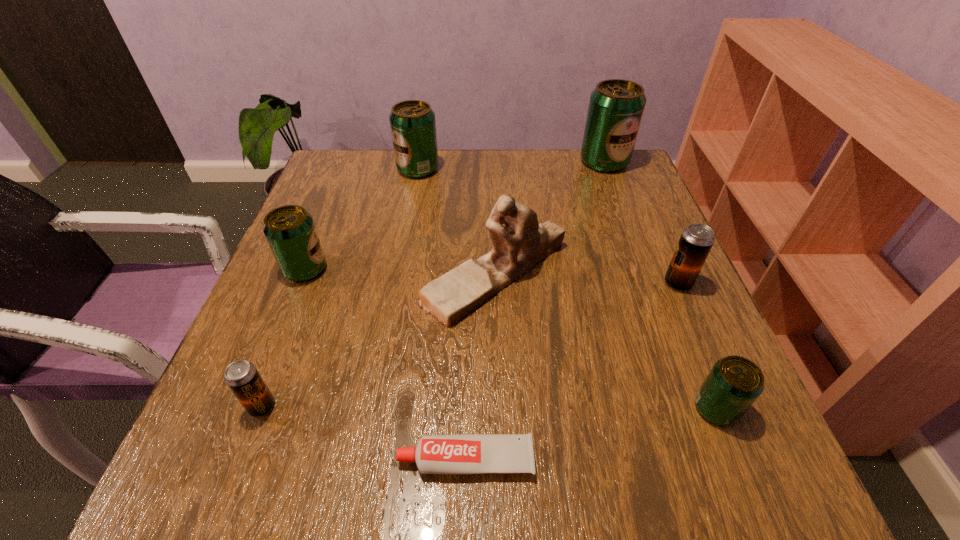
You are a GUI agent. You are given a task and a screenshot of the screen. Output one action in this format:
    pyautogui.click(x=<x>, y=<y>)
    Task: Click on the vacant space at the far right corner of the desktop
    This screenshot has height=540, width=960.
    Given the screenshot: What is the action you would take?
    pyautogui.click(x=595, y=173)

Locate an element on the screen. This screenshot has height=540, width=960. empty space that is in between the leftmost green beer can and the biggest green beer can is located at coordinates (455, 215).

At what (x,y) coordinates should I click in order to perform the action: click on vacant space that is in between the smallest green beer can and the figurine. Please return your answer as a coordinate pair (x, y). Looking at the image, I should click on (606, 341).

You are a GUI agent. You are given a task and a screenshot of the screen. Output one action in this format:
    pyautogui.click(x=<x>, y=<y>)
    Task: Click on the vacant point located between the second biggest green beer can and the biggest green beer can
    The height and width of the screenshot is (540, 960).
    Given the screenshot: What is the action you would take?
    pyautogui.click(x=511, y=165)

Locate an element on the screen. The height and width of the screenshot is (540, 960). empty space that is in between the nearest object and the leftmost green beer can is located at coordinates 385,364.

In order to click on vacant area between the third beer can from left to right and the smaller black beer can in this screenshot , I will do `click(340, 288)`.

This screenshot has height=540, width=960. Identify the location of unoccupied area between the fourth beer can from right to left and the figurine. (457, 221).

This screenshot has width=960, height=540. What are the coordinates of `free space between the farther black beer can and the smallest green beer can` in the screenshot? It's located at (697, 346).

In order to click on vacant space in between the second smallest green beer can and the smallest green beer can in this screenshot , I will do `click(511, 339)`.

Identify the location of vacant space that is in between the bigger black beer can and the shortest object. The width and height of the screenshot is (960, 540). (572, 371).